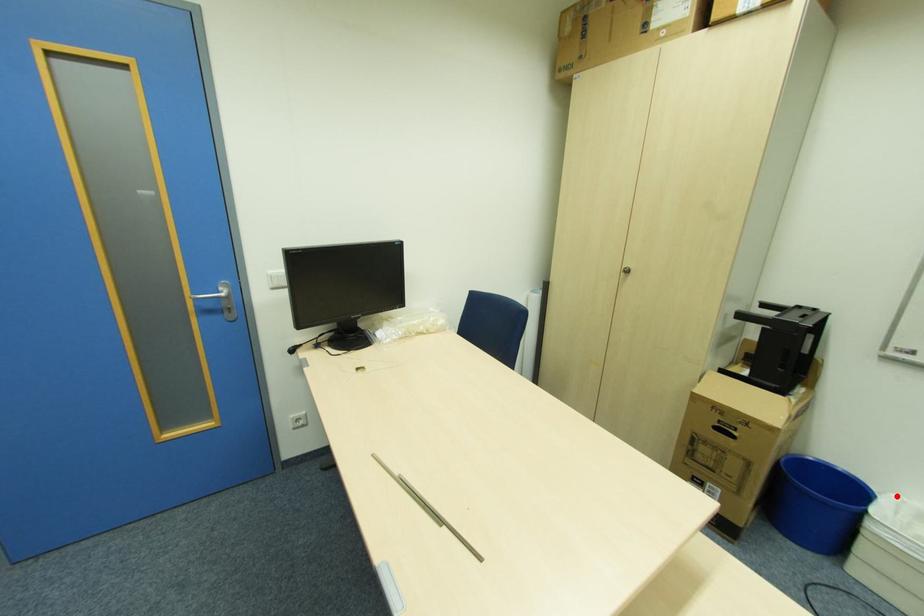
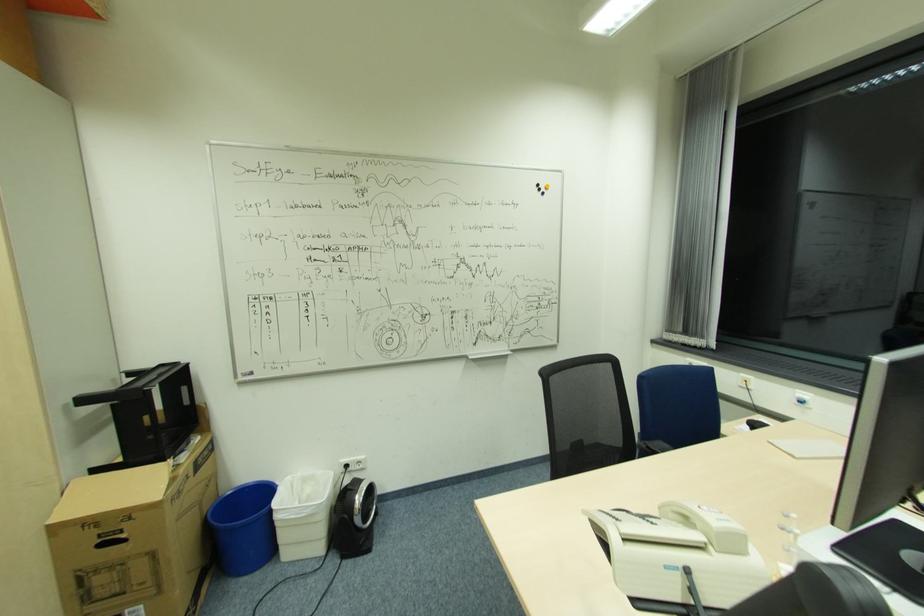
Find the pixel in the second image that matches the highlighted location in the first image.

(290, 477)